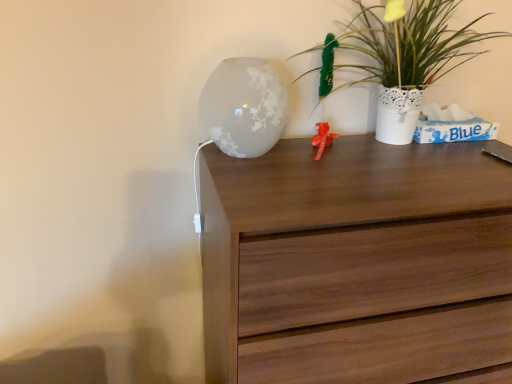
At what (x,y) coordinates should I click in order to perform the action: click on vacant area that lies in front of frosted glass vase at upper center. Please return your answer as a coordinate pair (x, y). Looking at the image, I should click on (x=268, y=184).